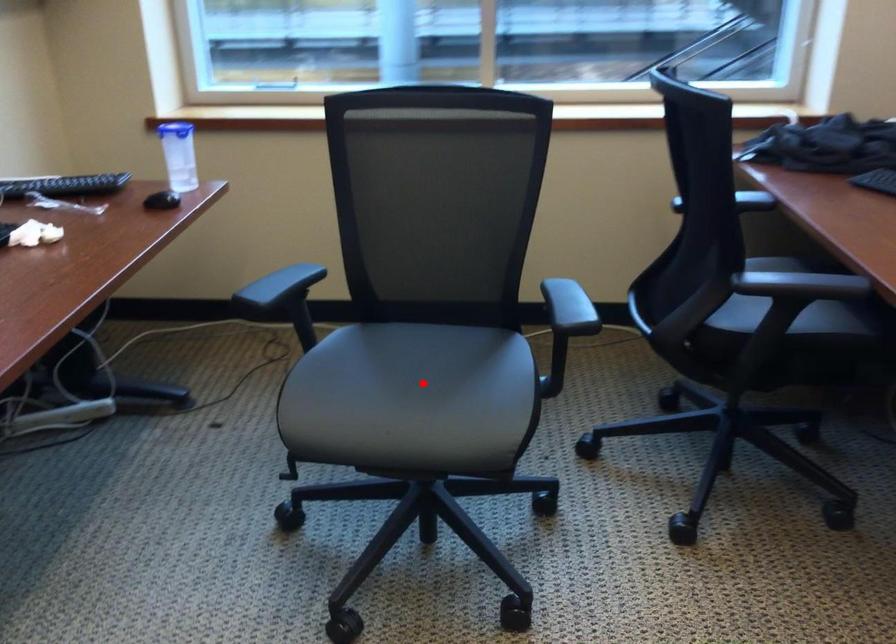
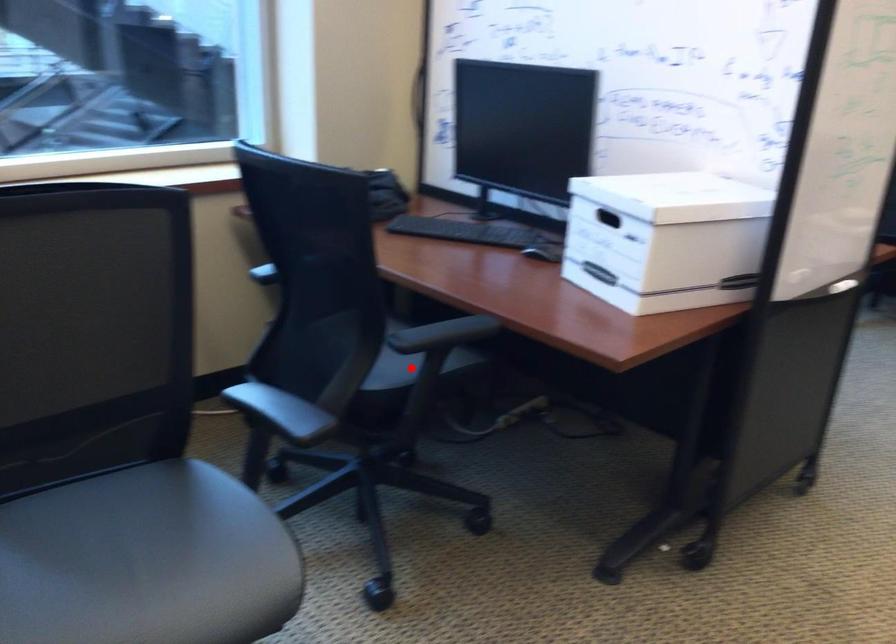
I am providing you with two images of the same scene from different viewpoints. A red point is marked on the first image and another point is marked on the second image. Do the highlighted points in image1 and image2 indicate the same real-world spot?

No